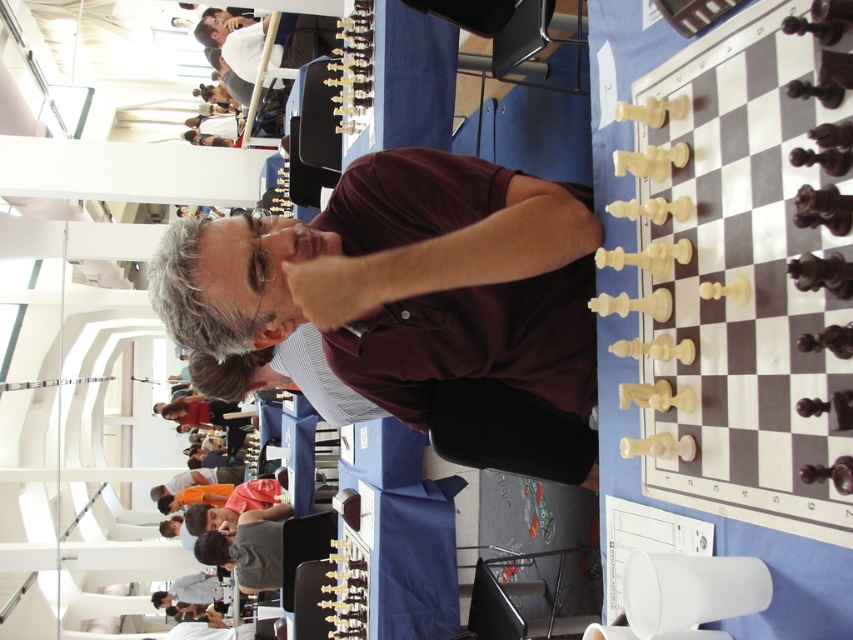
You are a chess player sitting at the table in the foreground. You notice the maroon shirt at center and the matte black chess set at upper center. Which object is located to the right of the other?

The maroon shirt at center is positioned on the right side of matte black chess set at upper center.

You are a photographer positioned at the back of the room. You want to capture a photo where the maroon shirt at center and the matte black chess set at upper center are both clearly visible. Based on their heights, which object will appear larger in the photo?

The maroon shirt at center has a greater height compared to the matte black chess set at upper center, so it will appear larger in the photo.

You are a chess player sitting at the table with the chessboard. You need to move a piece from point A to point B. The coordinates for point A are point [526,371] and point B are point [250,40]. Can you move directly from point A to point B without any obstructions?

Point [526,371] is in front of point [250,40], so moving from point A to point B would require moving backward, which might be obstructed by the chessboard or other pieces. Therefore, you cannot move directly from point A to point B without any obstructions.